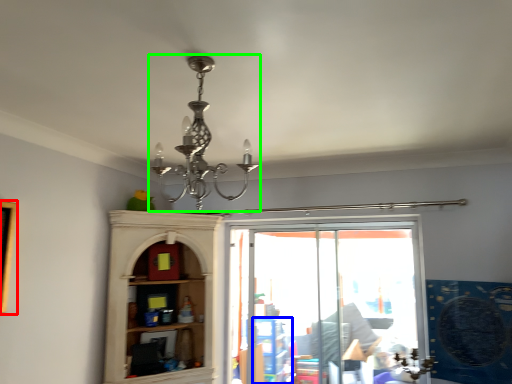
Question: Considering the real-world distances, which object is closest to picture frame (highlighted by a red box)? shelf (highlighted by a blue box) or lamp (highlighted by a green box).

Choices:
 (A) shelf
 (B) lamp

Answer: (B)